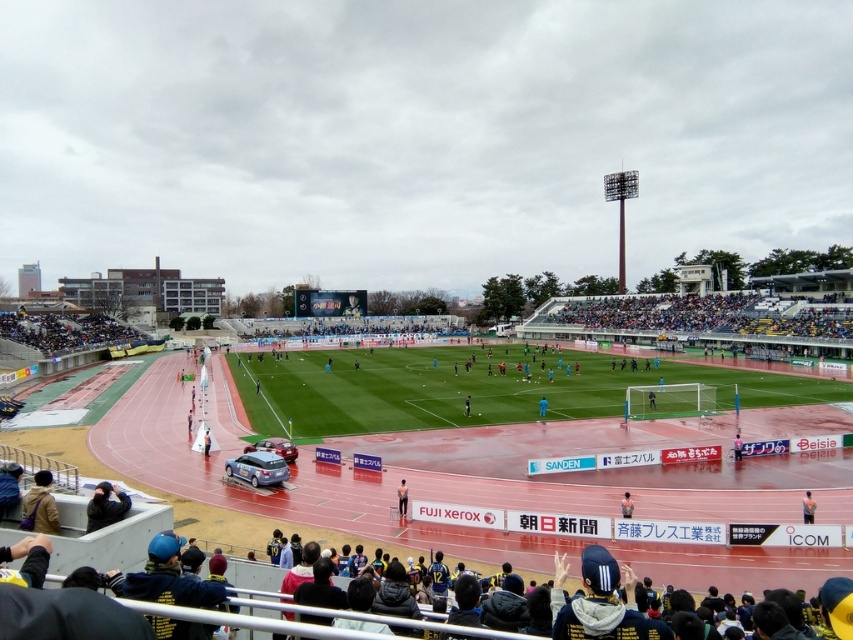
Question: Which point is closer to the camera?

Choices:
 (A) (206, 442)
 (B) (120, 323)
 (C) (103, 483)

Answer: (C)

Question: In this image, where is brown leather jacket at lower left located relative to blue fabric jacket at center?

Choices:
 (A) below
 (B) above

Answer: (B)

Question: Which point is closer to the camera taking this photo?

Choices:
 (A) (808, 492)
 (B) (401, 496)

Answer: (A)

Question: Does blue fabric person at center have a larger size compared to dark blue uniform at center?

Choices:
 (A) no
 (B) yes

Answer: (B)

Question: Is dark gray concrete crowd at lower left smaller than dark blue uniform at center?

Choices:
 (A) no
 (B) yes

Answer: (A)

Question: Which object appears farthest from the camera in this image?

Choices:
 (A) yellow uniformed person at center
 (B) dark blue uniform at center
 (C) dark blue fabric jacket at lower left

Answer: (B)